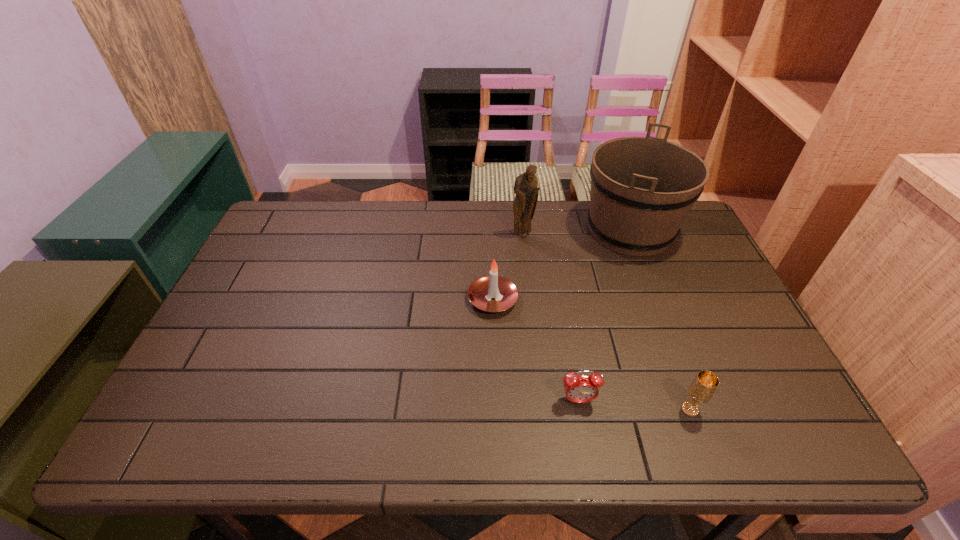
The image size is (960, 540). In order to click on empty space that is in between the chalice and the candle in this screenshot , I will do `click(591, 354)`.

The image size is (960, 540). Find the location of `free space between the figurine and the alarm clock`. free space between the figurine and the alarm clock is located at coordinates (550, 318).

Where is `the fourth closest object to the bucket`? The height and width of the screenshot is (540, 960). the fourth closest object to the bucket is located at coordinates (701, 390).

Locate which object ranks in proximity to the figurine. Please provide its 2D coordinates. Your answer should be formatted as a tuple, i.e. [(x, y)], where the tuple contains the x and y coordinates of a point satisfying the conditions above.

[(642, 188)]

At what (x,y) coordinates should I click in order to perform the action: click on free location that satisfies the following two spatial constraints: 1. on the front side of the chalice; 2. on the left side of the candle. Please return your answer as a coordinate pair (x, y). Looking at the image, I should click on (496, 409).